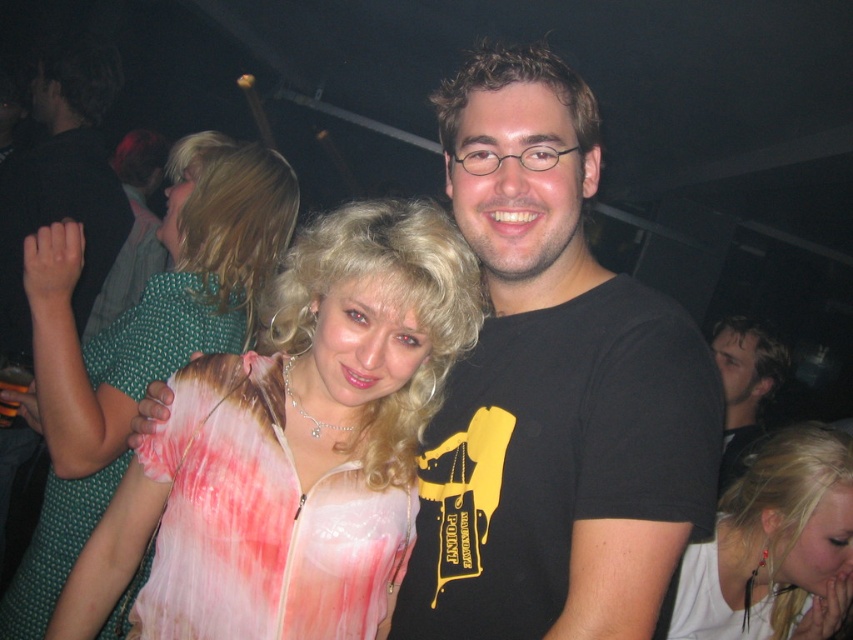
Question: Among these points, which one is nearest to the camera?

Choices:
 (A) (9, 241)
 (B) (732, 436)

Answer: (A)

Question: Is black matte t-shirt at center to the right of translucent pink fabric dress at center from the viewer's perspective?

Choices:
 (A) yes
 (B) no

Answer: (A)

Question: Where is white matte/soft hair at lower right located in relation to black matte t-shirt at upper right in the image?

Choices:
 (A) below
 (B) above

Answer: (A)

Question: Which object is closer to the camera taking this photo?

Choices:
 (A) black matte t-shirt at upper right
 (B) translucent pink fabric dress at center
 (C) white lace dress at upper left

Answer: (B)

Question: Is the position of black matte t-shirt at upper right more distant than that of black t-shirt at center?

Choices:
 (A) yes
 (B) no

Answer: (B)

Question: Estimate the real-world distances between objects in this image. Which object is farther from the black matte t-shirt at upper right?

Choices:
 (A) black t-shirt at center
 (B) white textured dress at center
 (C) black matte t-shirt at center
 (D) translucent pink fabric dress at center

Answer: (A)